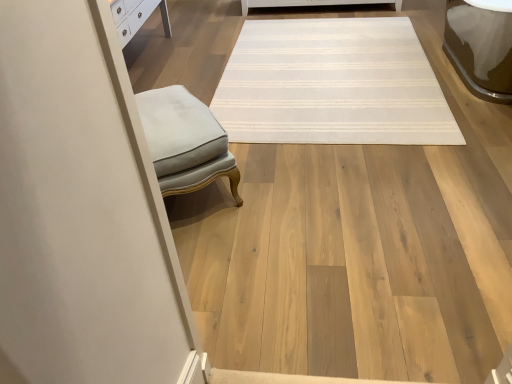
Question: Considering the relative sizes of light gray fabric ottoman at left and white striped rug at center in the image provided, is light gray fabric ottoman at left thinner than white striped rug at center?

Choices:
 (A) yes
 (B) no

Answer: (A)

Question: Is white striped rug at center completely or partially inside light gray fabric ottoman at left?

Choices:
 (A) yes
 (B) no

Answer: (B)

Question: Is light gray fabric ottoman at left outside of white striped rug at center?

Choices:
 (A) yes
 (B) no

Answer: (A)

Question: Is the depth of light gray fabric ottoman at left greater than that of white striped rug at center?

Choices:
 (A) yes
 (B) no

Answer: (B)

Question: Is light gray fabric ottoman at left not close to white striped rug at center?

Choices:
 (A) no
 (B) yes

Answer: (B)

Question: Is light gray fabric ottoman at left turned away from white striped rug at center?

Choices:
 (A) no
 (B) yes

Answer: (A)

Question: Is white striped rug at center bigger than light gray fabric ottoman at left?

Choices:
 (A) yes
 (B) no

Answer: (A)

Question: Would you say white striped rug at center is a long distance from light gray fabric ottoman at left?

Choices:
 (A) no
 (B) yes

Answer: (B)

Question: Is white striped rug at center not inside light gray fabric ottoman at left?

Choices:
 (A) no
 (B) yes

Answer: (B)

Question: Can you confirm if white striped rug at center is thinner than light gray fabric ottoman at left?

Choices:
 (A) no
 (B) yes

Answer: (A)

Question: Considering the relative sizes of white striped rug at center and light gray fabric ottoman at left in the image provided, is white striped rug at center smaller than light gray fabric ottoman at left?

Choices:
 (A) no
 (B) yes

Answer: (A)

Question: Considering the relative sizes of white striped rug at center and light gray fabric ottoman at left in the image provided, is white striped rug at center taller than light gray fabric ottoman at left?

Choices:
 (A) no
 (B) yes

Answer: (A)

Question: Is light gray fabric ottoman at left wider or thinner than white striped rug at center?

Choices:
 (A) thin
 (B) wide

Answer: (A)